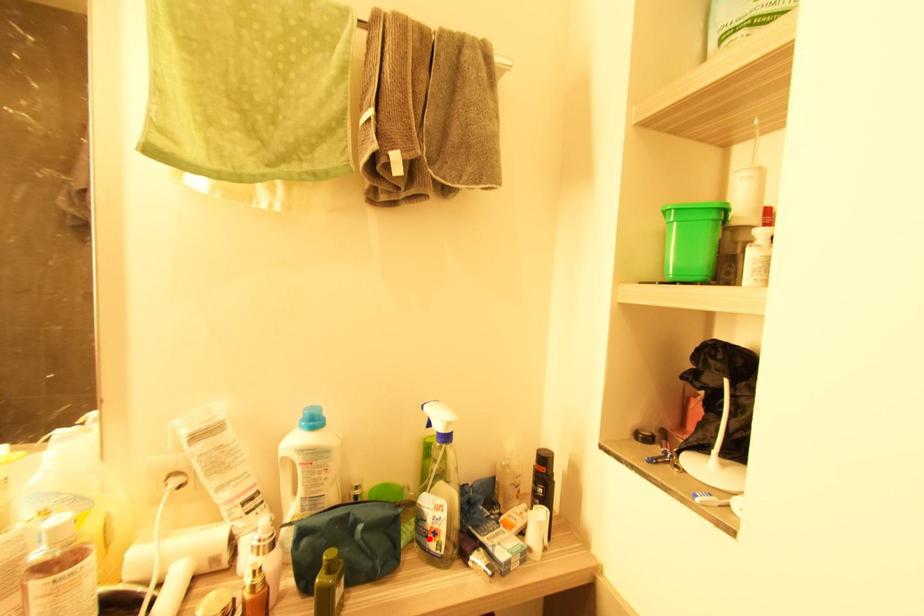
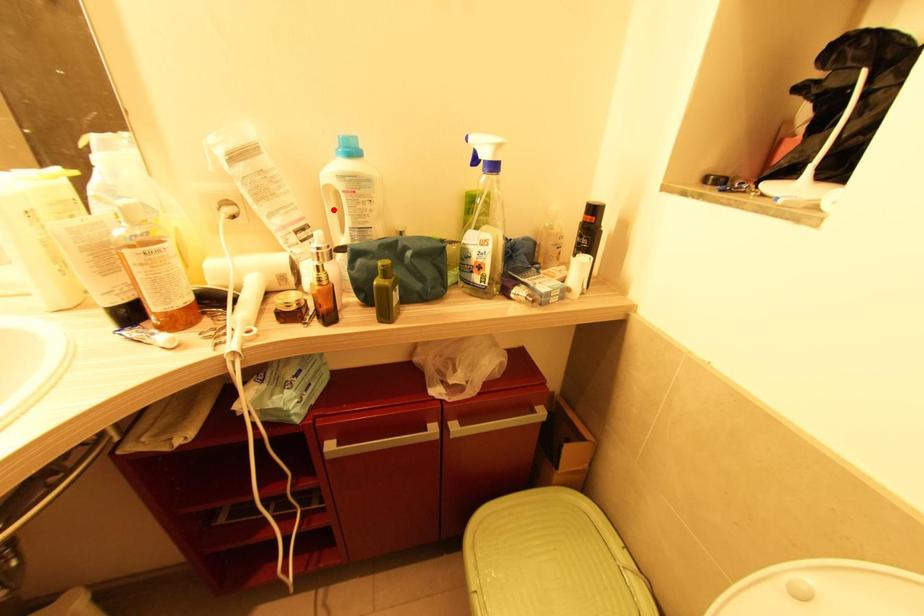
I am providing you with two images of the same scene from different viewpoints. A red point is marked on the first image and another point is marked on the second image. Is the red point in image1 aligned with the point shown in image2?

No